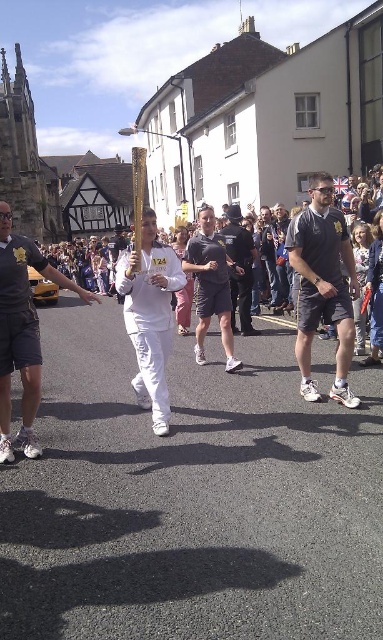
Does point (222, 252) come farther from viewer compared to point (245, 310)?

No, it is not.

Who is more distant from viewer, (191, 252) or (230, 275)?

Point (230, 275)

Between point (206, 234) and point (253, 332), which one is positioned in front?

Positioned in front is point (206, 234).

The height and width of the screenshot is (640, 383). I want to click on dark gray shorts at center, so click(212, 285).

Between matte yellow shirt at left and white matte running suit at center, which one is positioned higher?

Positioned higher is white matte running suit at center.

What do you see at coordinates (21, 332) in the screenshot?
I see `matte yellow shirt at left` at bounding box center [21, 332].

This screenshot has width=383, height=640. What are the coordinates of `matte yellow shirt at left` in the screenshot? It's located at (21, 332).

Does dark gray fabric shorts at center come behind white matte running suit at center?

Yes.

Is dark gray fabric shorts at center shorter than white matte running suit at center?

No, dark gray fabric shorts at center is not shorter than white matte running suit at center.

The image size is (383, 640). What do you see at coordinates (322, 285) in the screenshot?
I see `dark gray fabric shorts at center` at bounding box center [322, 285].

The image size is (383, 640). I want to click on dark gray fabric shorts at center, so click(322, 285).